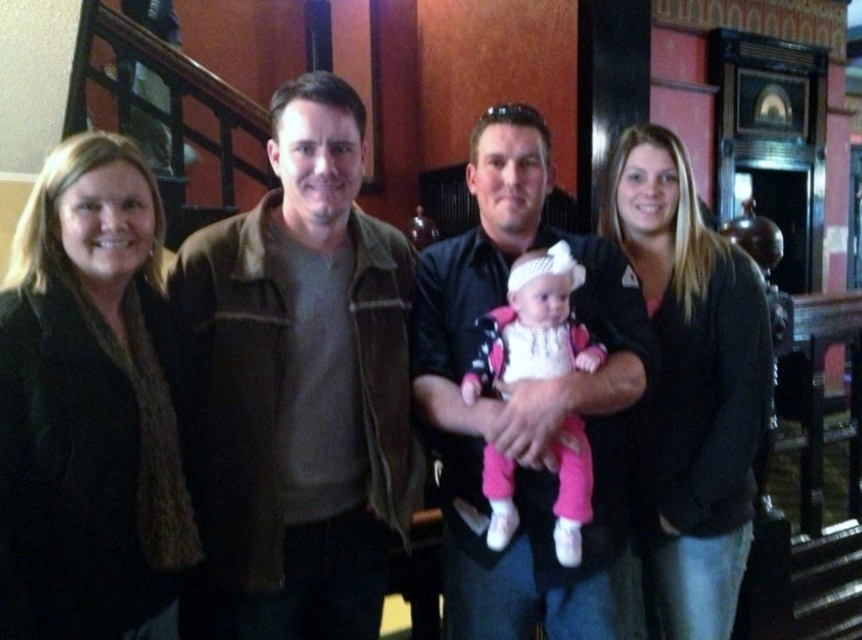
You are a photographer trying to capture a clear shot of both the black sweater at center and the pink fabric baby at center. Which object should you focus on first to ensure it appears sharp in the photo?

You should focus on the black sweater at center first because it is closer to you than the pink fabric baby at center, so focusing on it will keep both in focus if using a shallow depth of field.

You are a photographer preparing to take a group photo of the matte black shirt at center and the pink fabric baby at center. Considering their sizes, which object should you focus on first to ensure proper framing?

The matte black shirt at center is larger than the pink fabric baby at center, so you should focus on the matte black shirt at center first to ensure proper framing.